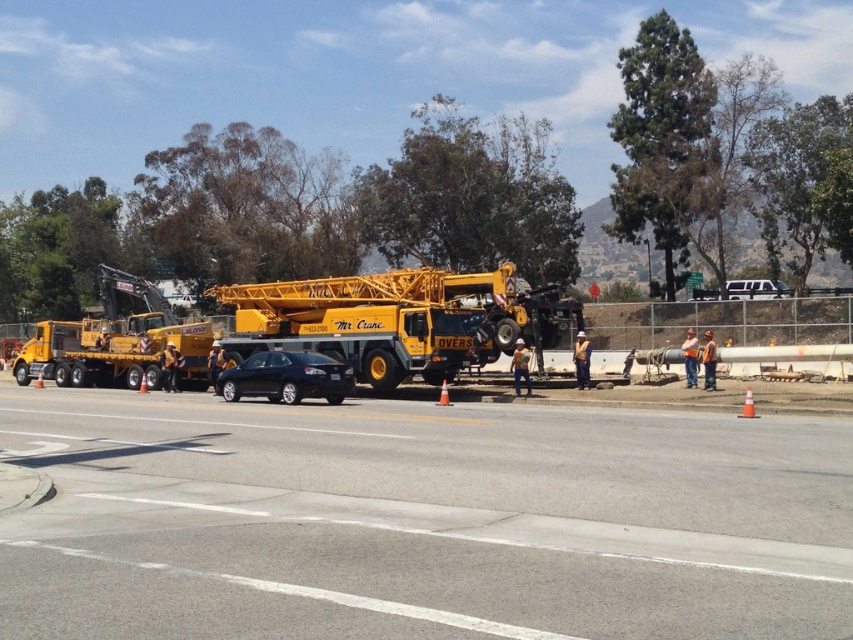
Who is taller, asphalt at center or yellow metallic crane at center?

yellow metallic crane at center

Identify the location of asphalt at center. (418, 520).

This screenshot has width=853, height=640. Describe the element at coordinates (418, 520) in the screenshot. I see `asphalt at center` at that location.

The height and width of the screenshot is (640, 853). What are the coordinates of `asphalt at center` in the screenshot? It's located at click(418, 520).